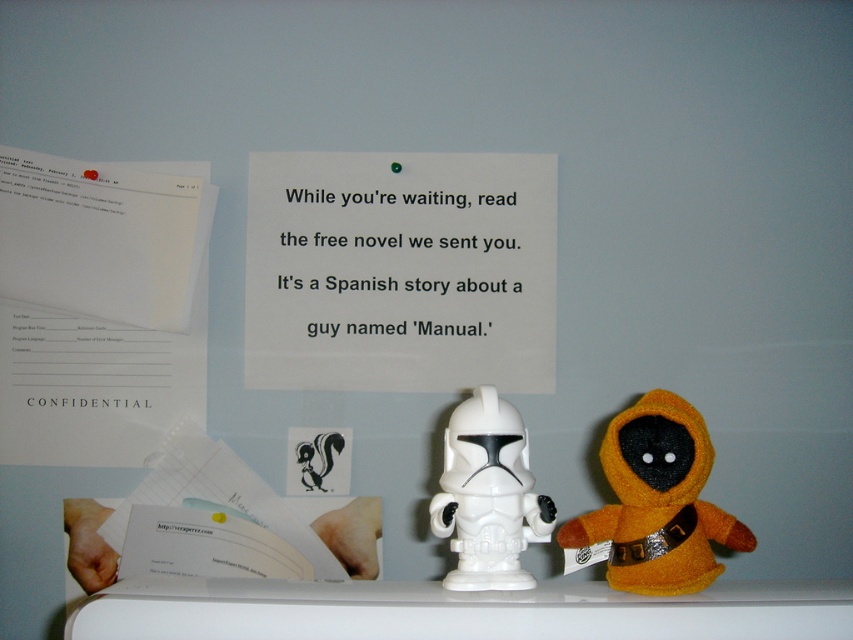
You are a child who wants to play with both the orange plush toy at center and the white plastic toy at center. Which toy is wider?

The orange plush toy at center is wider than the white plastic toy at center.

You are a customer waiting in the lobby and see the black paper at center and the white plastic toy at center on the wall. Which object is closer to the right side of the wall?

The white plastic toy at center is closer to the right side of the wall because the black paper at center is to the left of it.

You are a customer waiting in the lobby and see the black paper at center and the orange plush toy at center. Which object is closer to the ceiling?

The black paper at center is closer to the ceiling because it is above the orange plush toy at center.